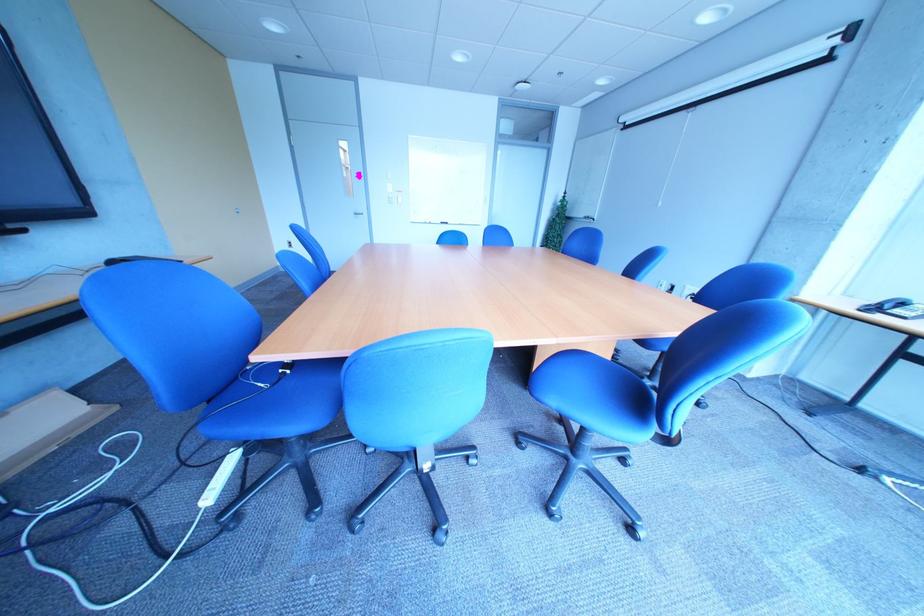
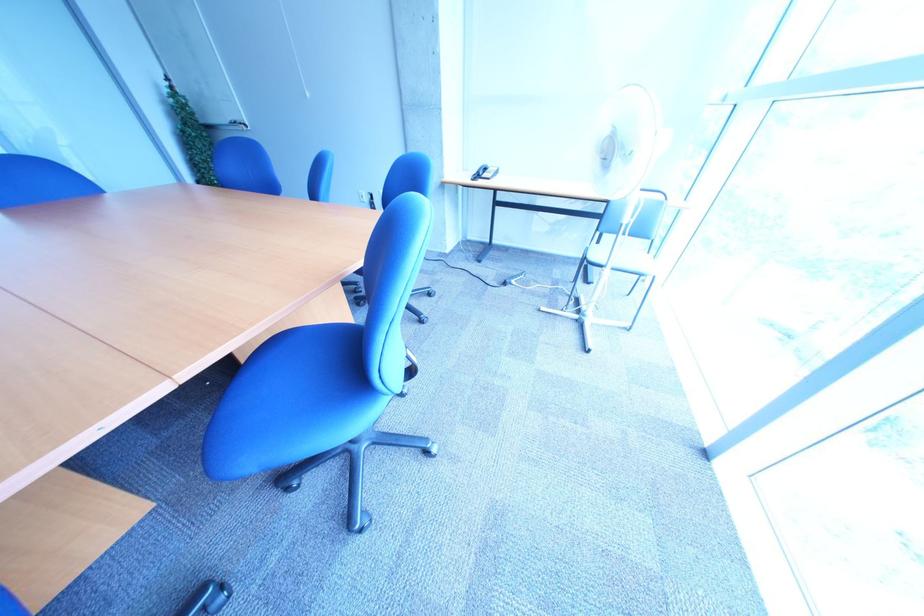
In the second image, find the point that corresponds to [894,306] in the first image.

(492, 174)